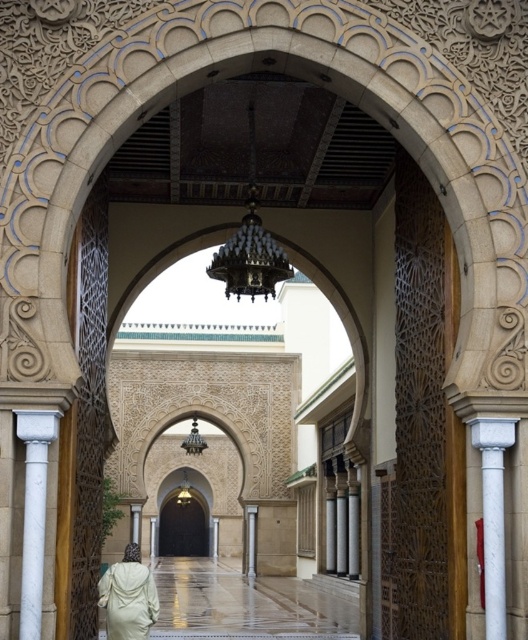
You are standing in the architectural space and want to take a photo of the white marble column at left. If your camera has a maximum focus range of 30 meters, will you be able to capture the column clearly?

The white marble column at left is 32.60 meters away from the camera, which exceeds the maximum focus range of 30 meters. Therefore, the column will not be in clear focus in the photo.

You are an architect examining the mosque design and need to determine the spatial arrangement. Which of the two white marble columns is narrower? The options are the white marble column at right and the white marble column at center.

The white marble column at right is narrower than the white marble column at center.

A drone is flying at the point marked as point (489, 531). It needs to deliver a package to the chandelier hanging inside the arched doorway. What is the minimum distance the drone must travel to reach the chandelier?

The minimum distance the drone must travel to reach the chandelier from point (489, 531) is 34.89 meters.